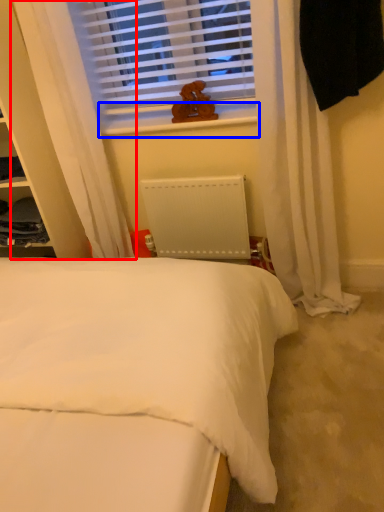
Question: Which object is closer to the camera taking this photo, curtain (highlighted by a red box) or window sill (highlighted by a blue box)?

Choices:
 (A) curtain
 (B) window sill

Answer: (A)